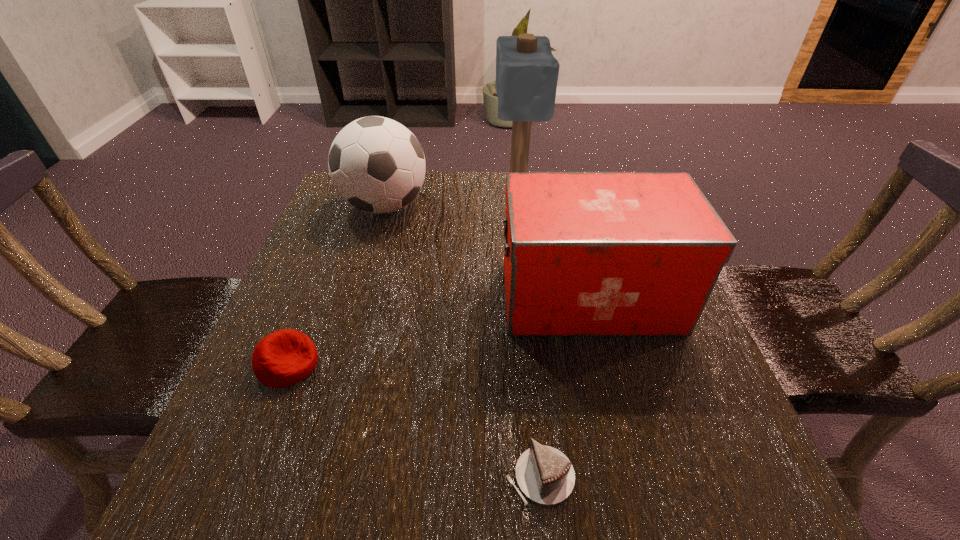
Image resolution: width=960 pixels, height=540 pixels. I want to click on mallet, so click(527, 72).

The width and height of the screenshot is (960, 540). I want to click on soccer ball, so click(377, 165).

Find the location of `the third farthest object`. the third farthest object is located at coordinates (585, 254).

This screenshot has width=960, height=540. Identify the location of the fourth farthest object. (283, 358).

The width and height of the screenshot is (960, 540). I want to click on beanbag, so click(x=283, y=358).

I want to click on the shortest object, so click(x=545, y=475).

Identify the location of chocolate cake. This screenshot has width=960, height=540. (545, 475).

The width and height of the screenshot is (960, 540). Find the location of `vacant area situated 0.150m on the left of the mallet`. vacant area situated 0.150m on the left of the mallet is located at coordinates (438, 192).

Where is `free space located 0.070m on the front of the soccer ball`? This screenshot has width=960, height=540. free space located 0.070m on the front of the soccer ball is located at coordinates (372, 251).

The height and width of the screenshot is (540, 960). Identify the location of free location located on the handle side of the first-aid kit. (431, 297).